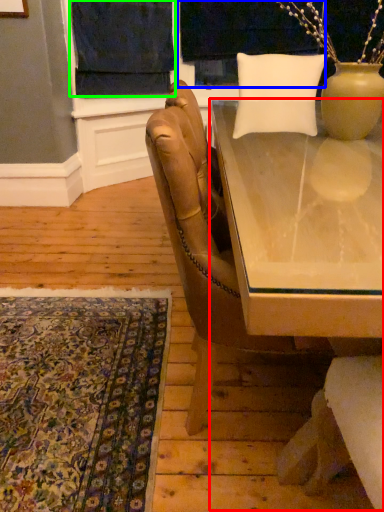
Question: Which object is positioned closest to table (highlighted by a red box)? Select from window screen (highlighted by a blue box) and curtain (highlighted by a green box).

Choices:
 (A) window screen
 (B) curtain

Answer: (B)